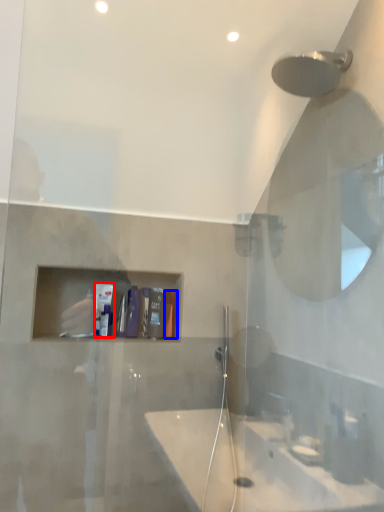
Question: Which point is further to the camera, toiletry (highlighted by a red box) or toiletry (highlighted by a blue box)?

Choices:
 (A) toiletry
 (B) toiletry

Answer: (B)